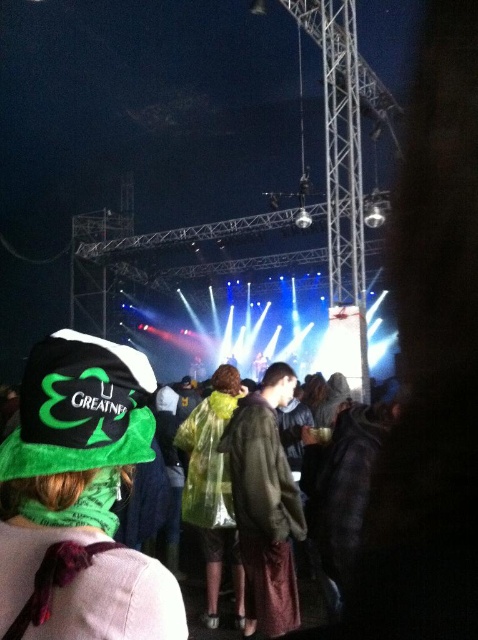
You are standing at the concert and want to take a photo of both the point at coordinates (77, 428) and the point at coordinates (282, 609). Which point should you focus on first to ensure both are in focus?

You should focus on the point at coordinates (77, 428) first because it is closer to the camera than the point at coordinates (282, 609). This ensures that both points will be within the depth of field when taking the photo.

You are a photographer at the concert and want to focus your camera on the green fabric jacket at center. However, the transparent plastic poncho at center is blocking your view. Is the poncho in front of or behind the jacket?

The green fabric jacket at center is closer to the viewer than the transparent plastic poncho at center, so the poncho is behind the jacket and not blocking the view.

You are a photographer trying to capture both the green fabric hat at lower left and the green fabric jacket at center in a single frame. Which object should you focus on first to ensure both are in the frame?

The green fabric hat at lower left occupies less space than the green fabric jacket at center, so you should focus on the green fabric jacket at center first to ensure both are in the frame.